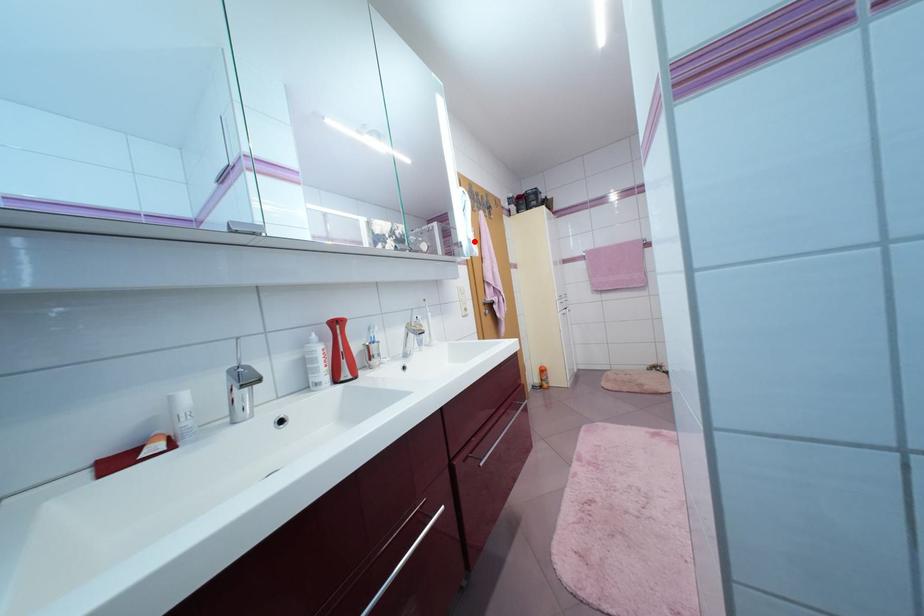
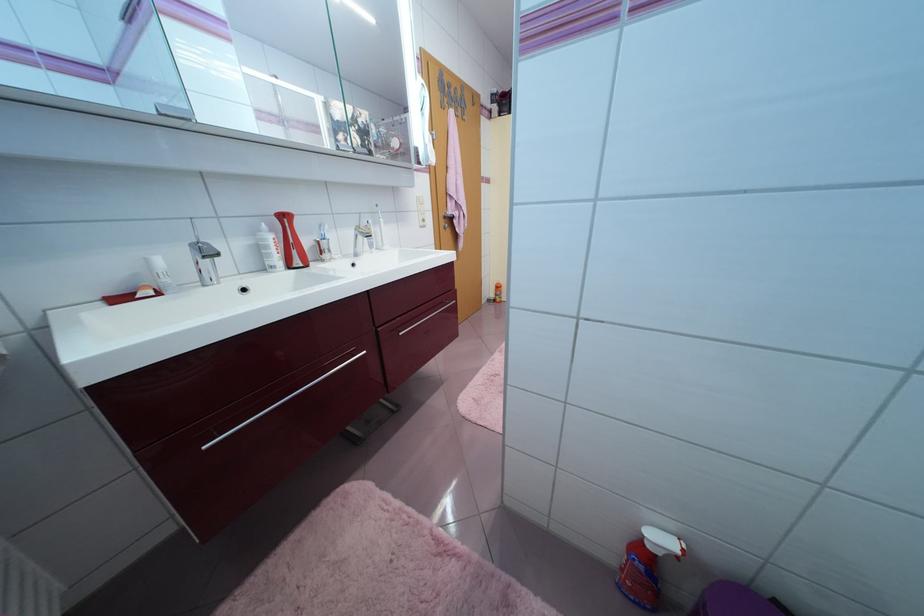
Locate, in the second image, the point that corresponds to the highlighted location in the first image.

(431, 147)